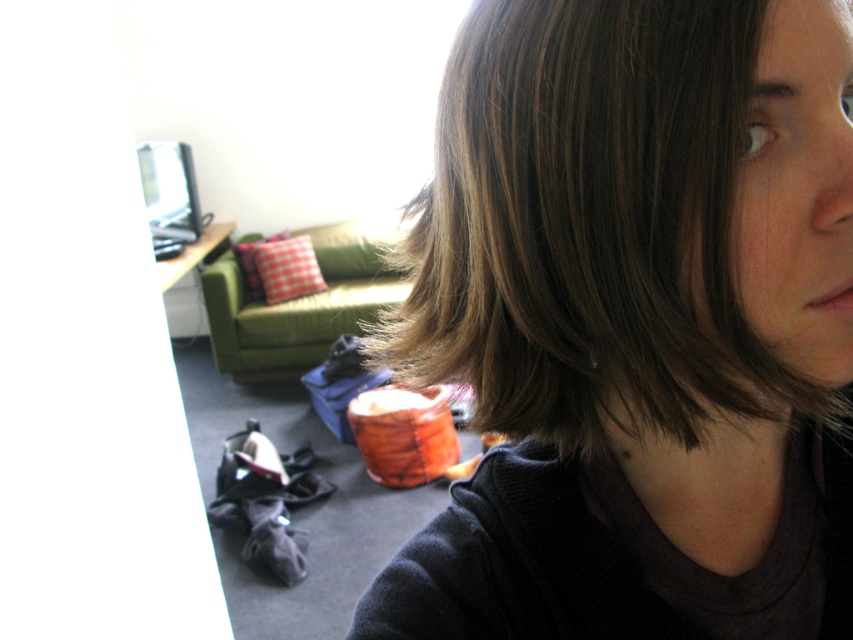
Is brown hair at center thinner than green fabric armchair at center?

Yes.

Which of these two, brown hair at center or green fabric armchair at center, stands shorter?

brown hair at center is shorter.

The image size is (853, 640). Describe the element at coordinates (636, 324) in the screenshot. I see `brown hair at center` at that location.

The width and height of the screenshot is (853, 640). In order to click on brown hair at center in this screenshot , I will do `click(636, 324)`.